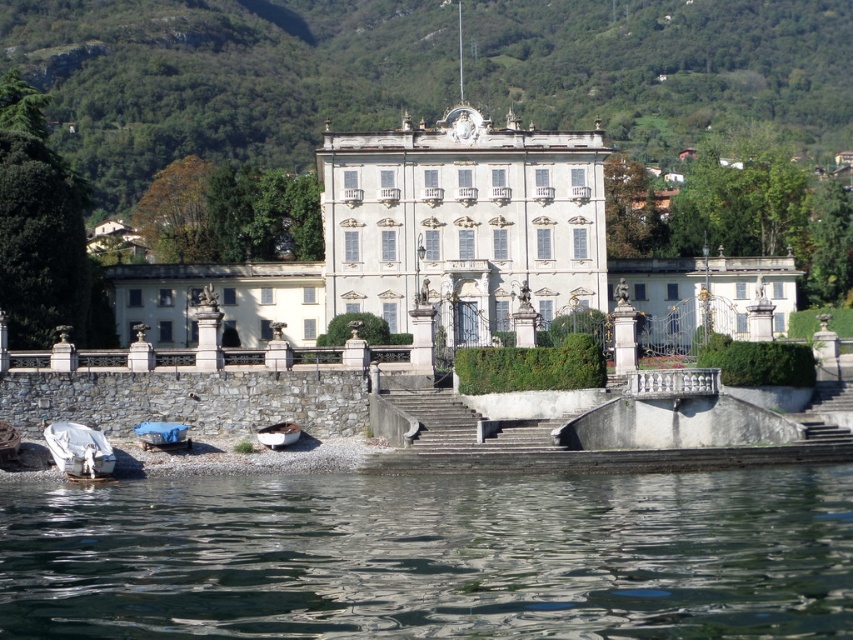
Can you confirm if white fabric boat at lower left is positioned above blue fabric boat at lower left?

No, white fabric boat at lower left is not above blue fabric boat at lower left.

Is point (93, 452) positioned after point (177, 433)?

No, (93, 452) is in front of (177, 433).

You are a GUI agent. You are given a task and a screenshot of the screen. Output one action in this format:
    pyautogui.click(x=<x>, y=<y>)
    Task: Click on the white fabric boat at lower left
    
    Given the screenshot: What is the action you would take?
    pyautogui.click(x=79, y=449)

Does clear water at lower center appear on the left side of white fabric boat at lower left?

No, clear water at lower center is not to the left of white fabric boat at lower left.

Is clear water at lower center to the right of white fabric boat at lower left from the viewer's perspective?

Yes, clear water at lower center is to the right of white fabric boat at lower left.

Where is `clear water at lower center`? Image resolution: width=853 pixels, height=640 pixels. clear water at lower center is located at coordinates (432, 556).

Measure the distance between clear water at lower center and camera.

145.22 feet

Which of these two, clear water at lower center or gray concrete stairs at center, stands shorter?

With less height is clear water at lower center.

Which is behind, point (846, 595) or point (457, 417)?

Positioned behind is point (457, 417).

Locate an element on the screen. The image size is (853, 640). clear water at lower center is located at coordinates (432, 556).